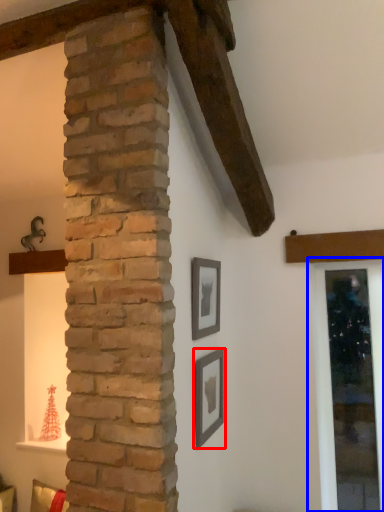
Question: Which of the following is the farthest to the observer, picture frame (highlighted by a red box) or window frame (highlighted by a blue box)?

Choices:
 (A) picture frame
 (B) window frame

Answer: (B)